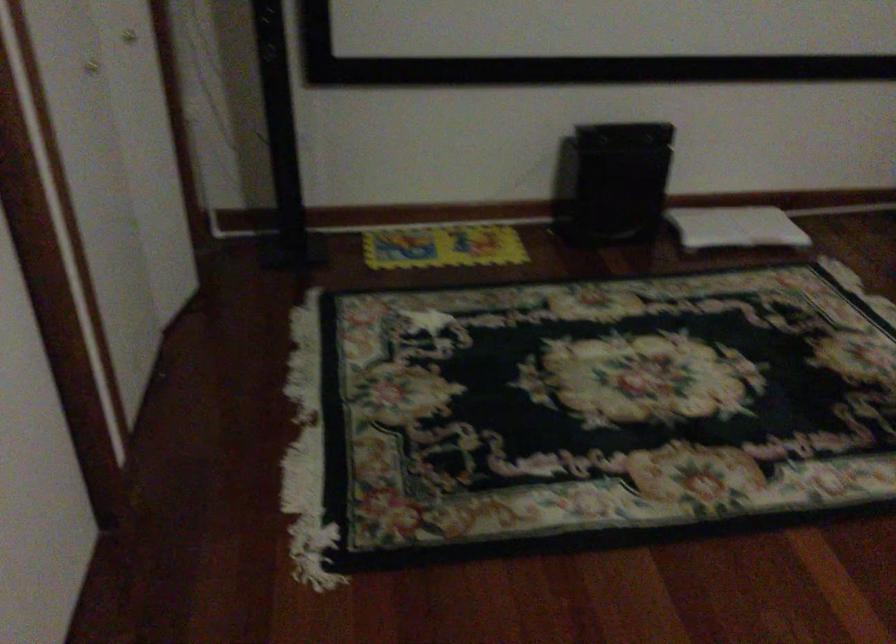
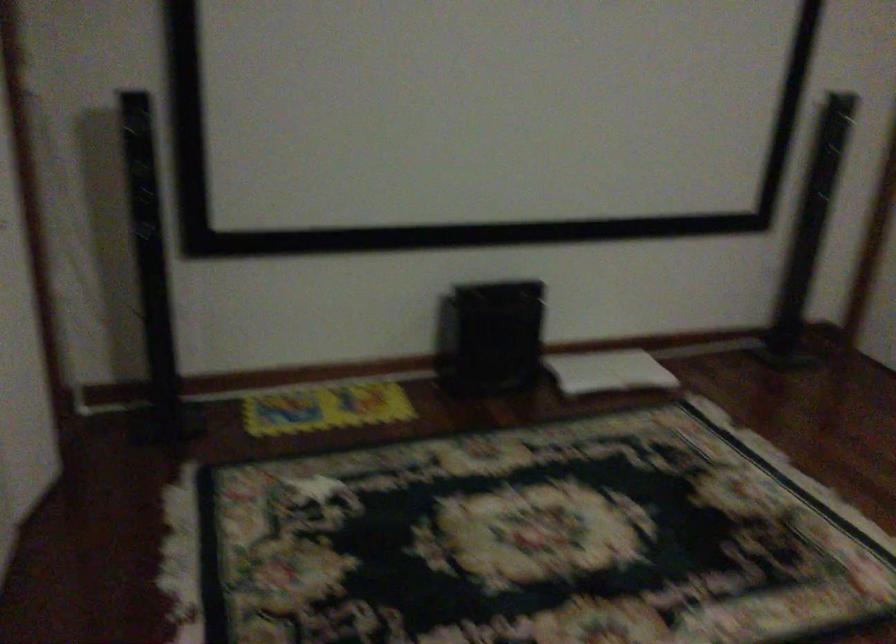
Question: Based on the continuous images, in which direction is the camera rotating? Reply with the corresponding letter.

Choices:
 (A) Left
 (B) Right
 (C) Up
 (D) Down

Answer: (C)